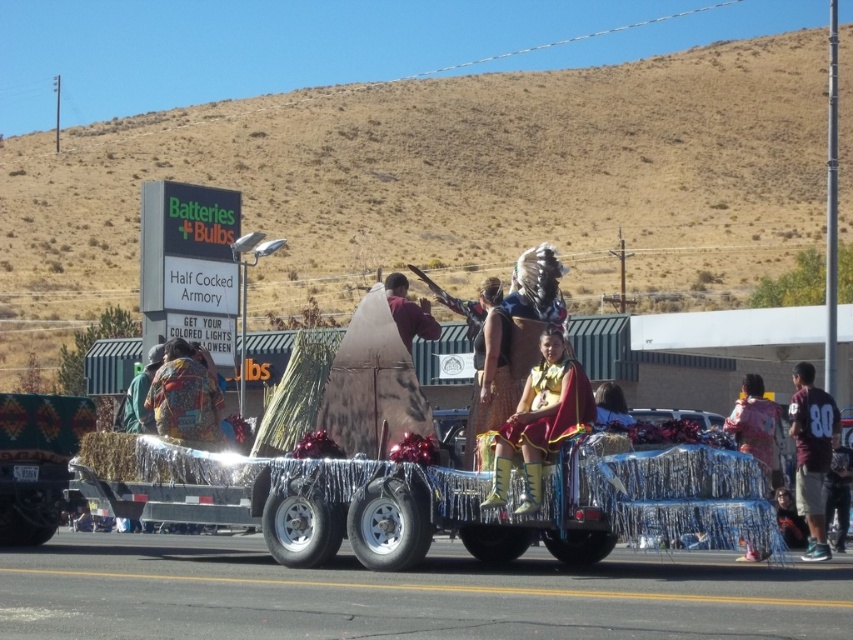
Is maroon jersey at right thinner than pink fabric at center?

Correct, maroon jersey at right's width is less than pink fabric at center's.

Is maroon jersey at right wider than pink fabric at center?

In fact, maroon jersey at right might be narrower than pink fabric at center.

What do you see at coordinates (811, 452) in the screenshot? I see `maroon jersey at right` at bounding box center [811, 452].

Locate an element on the screen. This screenshot has height=640, width=853. maroon jersey at right is located at coordinates (811, 452).

Who is shorter, pink fabric at center or matte brown vest at center?

Standing shorter between the two is matte brown vest at center.

Does pink fabric at center come behind matte brown vest at center?

No, pink fabric at center is closer to the viewer.

Measure the distance between pink fabric at center and camera.

The distance of pink fabric at center from camera is 17.73 meters.

The width and height of the screenshot is (853, 640). I want to click on pink fabric at center, so [756, 429].

Describe the element at coordinates (436, 497) in the screenshot. The height and width of the screenshot is (640, 853). I see `shiny metallic cart at center` at that location.

Identify the location of shiny metallic cart at center. Image resolution: width=853 pixels, height=640 pixels. (436, 497).

You are a GUI agent. You are given a task and a screenshot of the screen. Output one action in this format:
    pyautogui.click(x=<x>, y=<y>)
    Task: Click on the shiny metallic cart at center
    The height and width of the screenshot is (640, 853).
    Given the screenshot: What is the action you would take?
    pyautogui.click(x=436, y=497)